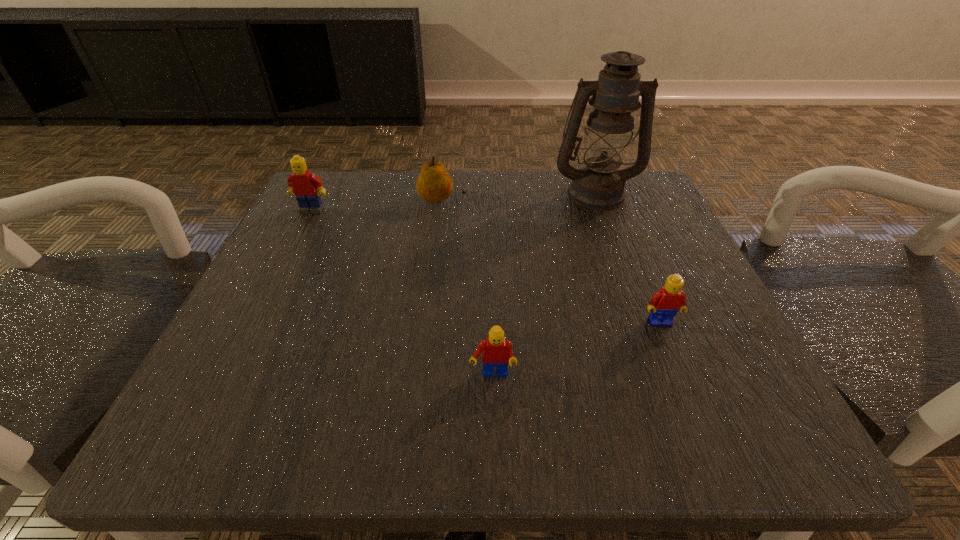
At what (x,y) coordinates should I click in order to perform the action: click on the tallest object. Please return your answer as a coordinate pair (x, y). This screenshot has height=540, width=960. Looking at the image, I should click on (599, 185).

Where is `the farthest Lego`? This screenshot has height=540, width=960. the farthest Lego is located at coordinates (307, 186).

Identify the location of the leftmost Lego. This screenshot has width=960, height=540. 307,186.

The height and width of the screenshot is (540, 960). Find the location of `the second object from left to right`. the second object from left to right is located at coordinates (434, 184).

This screenshot has height=540, width=960. I want to click on the second nearest Lego, so click(665, 303).

Where is `the fourth farthest object`? The height and width of the screenshot is (540, 960). the fourth farthest object is located at coordinates (665, 303).

Where is `the nearest Lego`? The image size is (960, 540). the nearest Lego is located at coordinates (496, 351).

Locate an element on the screen. This screenshot has width=960, height=540. the third object from left to right is located at coordinates (496, 351).

What are the coordinates of `free space located 0.140m on the front of the tallest object` in the screenshot? It's located at (618, 254).

Where is `free space located on the front-facing side of the second tallest object`? free space located on the front-facing side of the second tallest object is located at coordinates (267, 298).